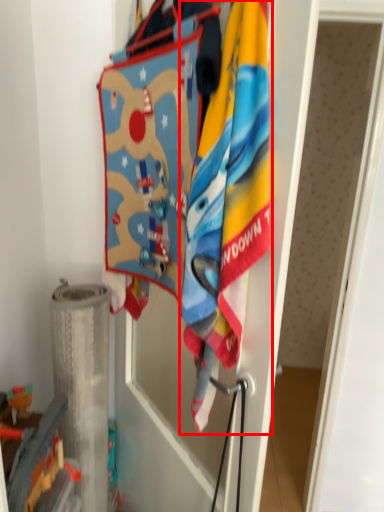
Question: From the image's perspective, what is the correct spatial relationship of towel (annotated by the red box) in relation to toy?

Choices:
 (A) above
 (B) below

Answer: (A)